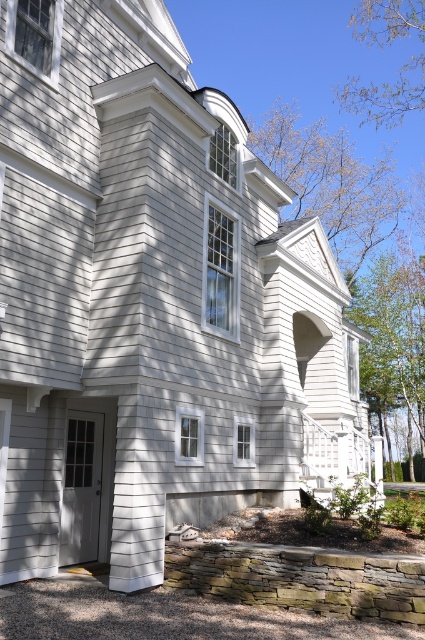
Can you confirm if green leafy tree at right is positioned to the right of brown leafy tree at upper right?

No, green leafy tree at right is not to the right of brown leafy tree at upper right.

Between green leafy tree at right and brown leafy tree at upper right, which one appears on the right side from the viewer's perspective?

brown leafy tree at upper right is more to the right.

Is point (387, 268) closer to camera compared to point (405, 10)?

No, it is behind (405, 10).

What are the coordinates of `green leafy tree at right` in the screenshot? It's located at (393, 340).

Does brown leafy tree at upper center appear over brown leafy tree at upper right?

Incorrect, brown leafy tree at upper center is not positioned above brown leafy tree at upper right.

Does brown leafy tree at upper center appear under brown leafy tree at upper right?

Correct, brown leafy tree at upper center is located below brown leafy tree at upper right.

Is point (350, 253) positioned before point (391, 6)?

No, it is behind (391, 6).

This screenshot has height=640, width=425. Identify the location of brown leafy tree at upper center. (331, 182).

Is brown leafy tree at upper center bigger than green leafy tree at right?

Yes, brown leafy tree at upper center is bigger than green leafy tree at right.

Can you confirm if brown leafy tree at upper center is wider than green leafy tree at right?

Yes, brown leafy tree at upper center is wider than green leafy tree at right.

The width and height of the screenshot is (425, 640). What are the coordinates of `brown leafy tree at upper center` in the screenshot? It's located at (331, 182).